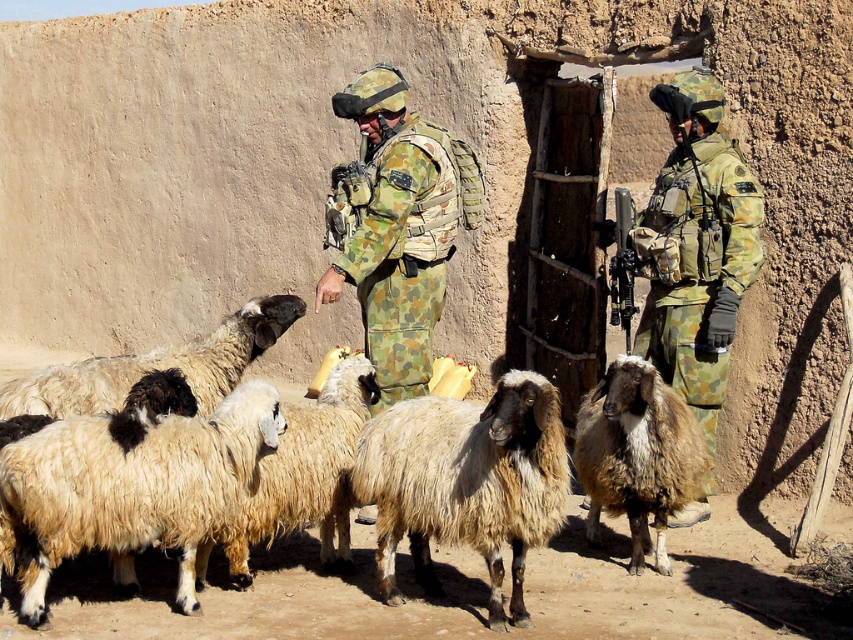
This screenshot has width=853, height=640. Find the location of `fuzzy woolen sheep at lower left`. fuzzy woolen sheep at lower left is located at coordinates (132, 484).

Can you confirm if fuzzy woolen sheep at lower left is smaller than fuzzy beige wool at center?

Indeed, fuzzy woolen sheep at lower left has a smaller size compared to fuzzy beige wool at center.

Does point (96, 528) come in front of point (424, 435)?

Yes, it is in front of point (424, 435).

Find the location of a particular element. This screenshot has width=853, height=640. fuzzy woolen sheep at lower left is located at coordinates (132, 484).

Does fuzzy beige wool at center appear on the left side of camouflage uniform at center?

Correct, you'll find fuzzy beige wool at center to the left of camouflage uniform at center.

Which is above, fuzzy beige wool at center or camouflage uniform at center?

Positioned higher is camouflage uniform at center.

Find the location of a particular element. This screenshot has width=853, height=640. fuzzy beige wool at center is located at coordinates (466, 483).

Can you confirm if camouflage uniform at center is positioned to the left of fuzzy brown goat at center?

Incorrect, camouflage uniform at center is not on the left side of fuzzy brown goat at center.

Is camouflage uniform at center below fuzzy brown goat at center?

Incorrect, camouflage uniform at center is not positioned below fuzzy brown goat at center.

This screenshot has height=640, width=853. Find the location of `camouflage uniform at center`. camouflage uniform at center is located at coordinates (695, 246).

Identify the location of camouflage uniform at center. (695, 246).